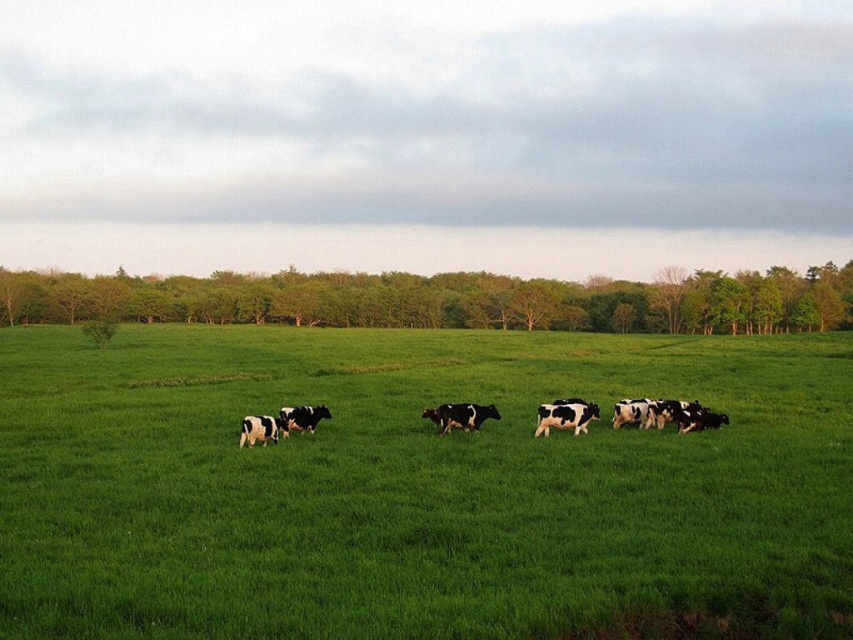
Is green grass pasture at center below black and white spotted cows at center?

Correct, green grass pasture at center is located below black and white spotted cows at center.

How far apart are green grass pasture at center and black and white spotted cows at center?

55.37 feet

The height and width of the screenshot is (640, 853). Identify the location of green grass pasture at center. (415, 484).

Identify the location of green grass pasture at center. (415, 484).

Is green grass pasture at center smaller than green leafy trees at upper center?

Correct, green grass pasture at center occupies less space than green leafy trees at upper center.

Is green grass pasture at center below green leafy trees at upper center?

Correct, green grass pasture at center is located below green leafy trees at upper center.

Between point (489, 372) and point (763, 291), which one is positioned in front?

Positioned in front is point (489, 372).

At what (x,y) coordinates should I click in order to perform the action: click on green grass pasture at center. Please return your answer as a coordinate pair (x, y). This screenshot has height=640, width=853. Looking at the image, I should click on (415, 484).

Is green leafy trees at upper center thinner than black and white spotted cows at center?

In fact, green leafy trees at upper center might be wider than black and white spotted cows at center.

How distant is green leafy trees at upper center from black and white spotted cows at center?

green leafy trees at upper center and black and white spotted cows at center are 124.13 meters apart from each other.

What are the coordinates of `green leafy trees at upper center` in the screenshot? It's located at (445, 300).